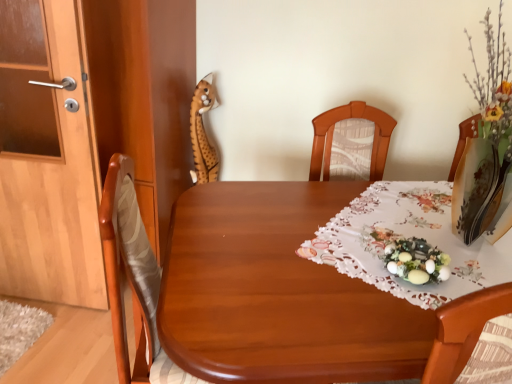
The image size is (512, 384). I want to click on vacant space behind pastel floral wreath at center, so click(396, 229).